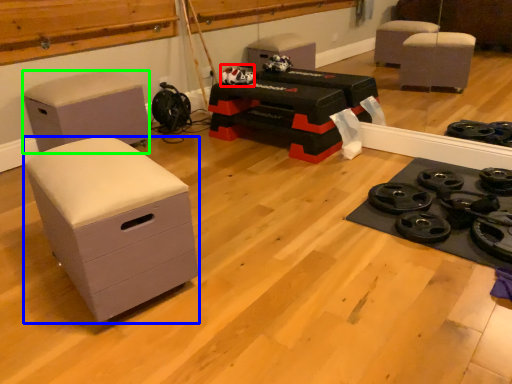
Question: Based on their relative distances, which object is farther from toy (highlighted by a red box)? Choose from chest of drawers (highlighted by a blue box) and furniture (highlighted by a green box).

Choices:
 (A) chest of drawers
 (B) furniture

Answer: (A)